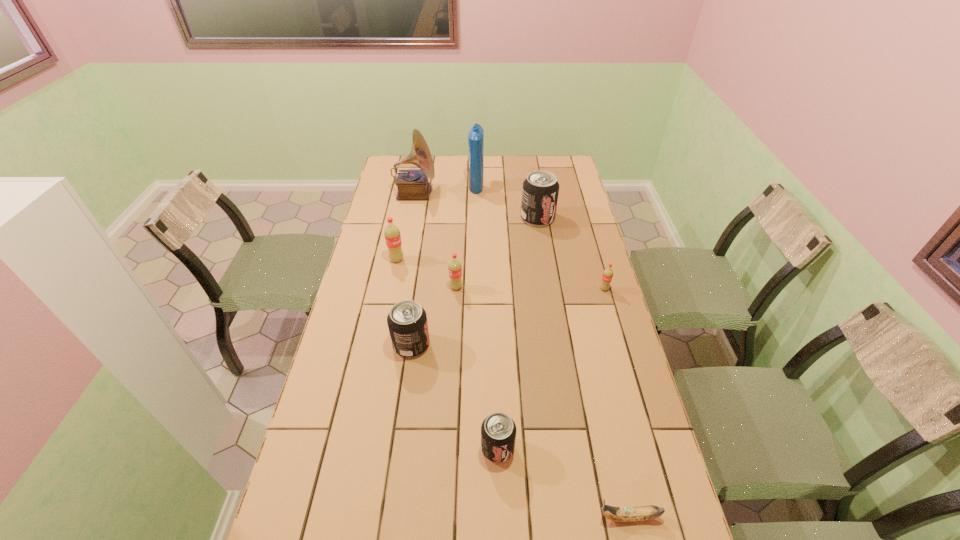
Where is `free space between the shampoo and the fourth farthest object`? free space between the shampoo and the fourth farthest object is located at coordinates (437, 222).

Where is `vacant area between the brown phonograph record and the leftmost black soda can`? The height and width of the screenshot is (540, 960). vacant area between the brown phonograph record and the leftmost black soda can is located at coordinates (x=413, y=269).

Identify the location of unoccupied position between the rightmost red soda and the shampoo. (540, 237).

Locate an element on the screen. This screenshot has height=540, width=960. free space between the fifth soda can from left to right and the shampoo is located at coordinates (507, 201).

Image resolution: width=960 pixels, height=540 pixels. I want to click on free space between the smallest red soda and the second smallest red soda, so click(530, 288).

I want to click on empty space that is in between the second red soda from right to left and the leftmost black soda can, so (x=434, y=316).

What are the coordinates of `the seventh closest object to the fourth soda can from left to right` in the screenshot? It's located at (412, 184).

Identify the location of object that is the third closest to the biggest red soda. This screenshot has height=540, width=960. (407, 321).

Choose which soda can is the third nearest neighbor to the shampoo. Please provide its 2D coordinates. Your answer should be formatted as a tuple, i.e. [(x, y)], where the tuple contains the x and y coordinates of a point satisfying the conditions above.

[(455, 268)]

Find the location of `soda can object that ranks as the closest to the smallest black soda can`. soda can object that ranks as the closest to the smallest black soda can is located at coordinates (407, 321).